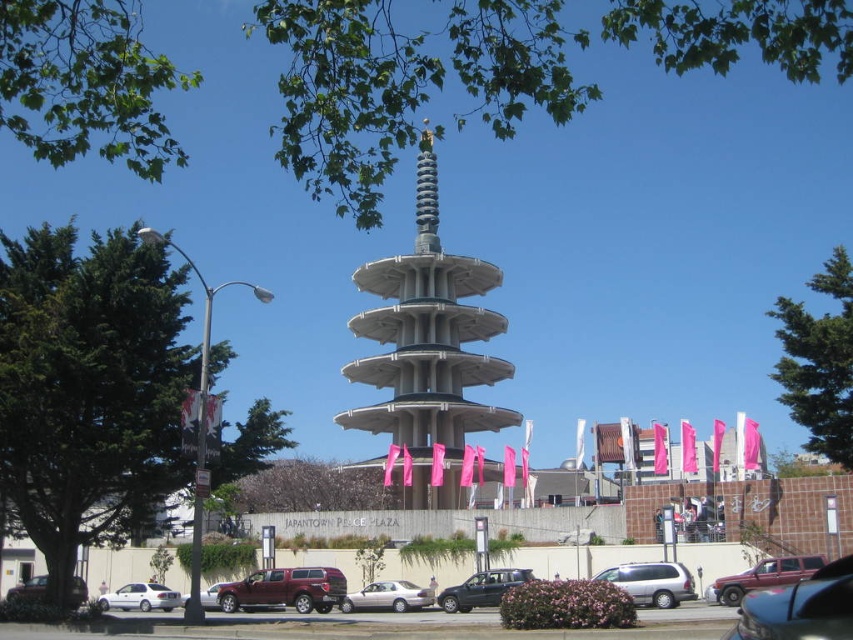
Which is above, maroon matte truck at lower left or metallic maroon suv at lower right?

metallic maroon suv at lower right is above.

Who is taller, maroon matte truck at lower left or metallic maroon suv at lower right?

maroon matte truck at lower left is taller.

Is point (323, 592) more distant than point (764, 577)?

That is True.

At what (x,y) coordinates should I click in order to perform the action: click on maroon matte truck at lower left. Please return your answer as a coordinate pair (x, y). The width and height of the screenshot is (853, 640). Looking at the image, I should click on (285, 589).

Where is `white matte sedan at lower left`? The image size is (853, 640). white matte sedan at lower left is located at coordinates (140, 596).

Who is more forward, [160,605] or [39,579]?

Point [160,605] is in front.

Describe the element at coordinates (140, 596) in the screenshot. I see `white matte sedan at lower left` at that location.

I want to click on white matte sedan at lower left, so click(x=140, y=596).

Is concrete gray tower at center above matte black car at center?

Yes.

Does concrete gray tower at center have a larger size compared to matte black car at center?

Indeed, concrete gray tower at center has a larger size compared to matte black car at center.

At what (x,y) coordinates should I click in order to perform the action: click on concrete gray tower at center. Please return your answer as a coordinate pair (x, y). Looking at the image, I should click on (427, 348).